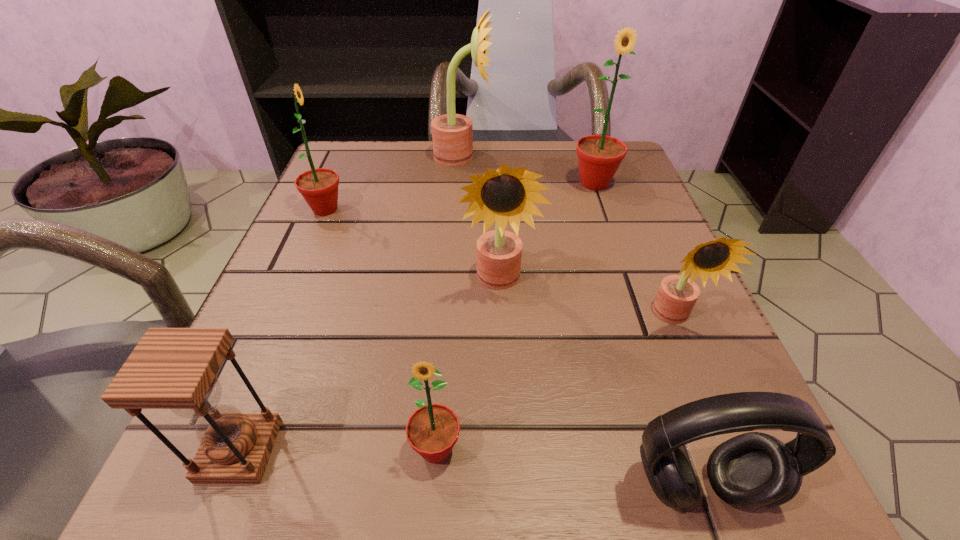
The width and height of the screenshot is (960, 540). I want to click on free space at the right edge, so click(x=645, y=387).

Identify the location of vacant space at the far left corner of the desktop. (350, 145).

In the image, there is a desktop. Identify the location of vacant region at the far right corner. The image size is (960, 540). (629, 194).

Find the location of a particular element. This screenshot has width=960, height=540. free area in between the biggest green sunflower and the biggest yellow sunflower is located at coordinates (528, 170).

Where is `vacant space that's between the gray headset and the nearest sunflower`? The height and width of the screenshot is (540, 960). vacant space that's between the gray headset and the nearest sunflower is located at coordinates (567, 468).

You are a GUI agent. You are given a task and a screenshot of the screen. Output one action in this format:
    pyautogui.click(x=<x>, y=<y>)
    Task: Click on the free space that is in between the nearest sunflower and the hourglass
    
    Given the screenshot: What is the action you would take?
    pyautogui.click(x=338, y=450)

The width and height of the screenshot is (960, 540). I want to click on empty space that is in between the leftmost green sunflower and the headset, so click(513, 348).

Image resolution: width=960 pixels, height=540 pixels. I want to click on free spot between the farthest green sunflower and the leftmost green sunflower, so click(x=460, y=197).

Image resolution: width=960 pixels, height=540 pixels. I want to click on vacant space that is in between the rightmost green sunflower and the biggest yellow sunflower, so click(528, 170).

Locate an element on the screen. Image resolution: width=960 pixels, height=540 pixels. free space between the farthest green sunflower and the second biggest yellow sunflower is located at coordinates (546, 232).